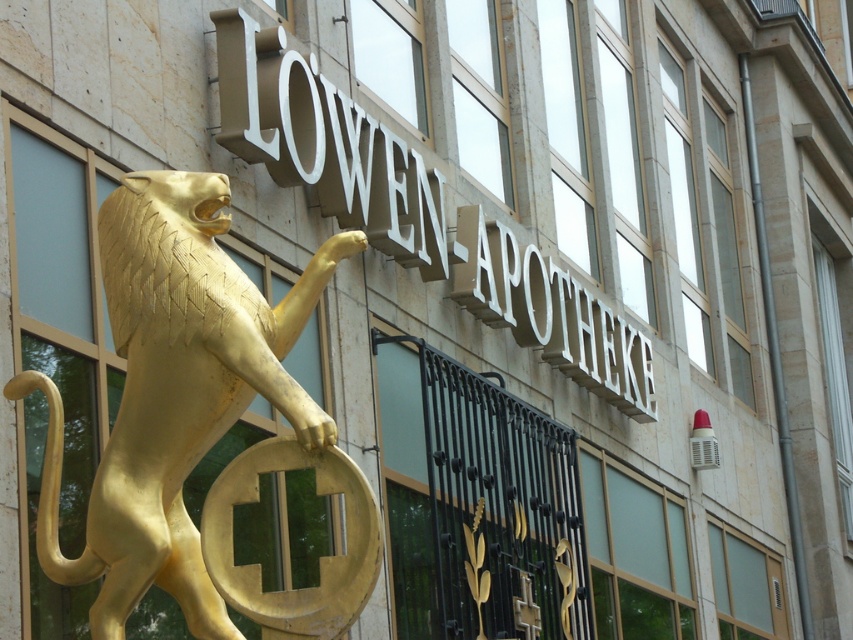
Question: From the image, what is the correct spatial relationship of gold polished lion at left in relation to matte gold sign at upper center?

Choices:
 (A) left
 (B) right

Answer: (A)

Question: Does gold polished lion at left appear under matte gold sign at upper center?

Choices:
 (A) yes
 (B) no

Answer: (A)

Question: Can you confirm if gold polished lion at left is bigger than matte gold sign at upper center?

Choices:
 (A) no
 (B) yes

Answer: (A)

Question: Which of the following is the farthest from the observer?

Choices:
 (A) pyautogui.click(x=492, y=273)
 (B) pyautogui.click(x=107, y=216)

Answer: (A)